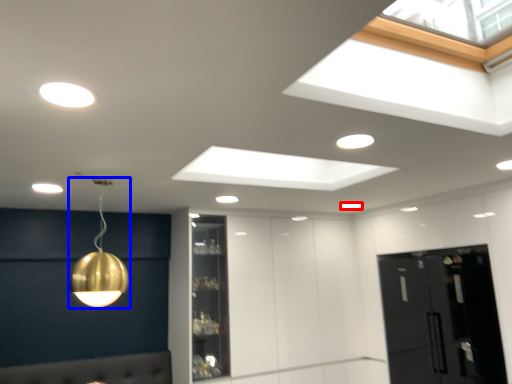
Question: Which point is further to the camera, lamp (highlighted by a red box) or lamp (highlighted by a blue box)?

Choices:
 (A) lamp
 (B) lamp

Answer: (A)